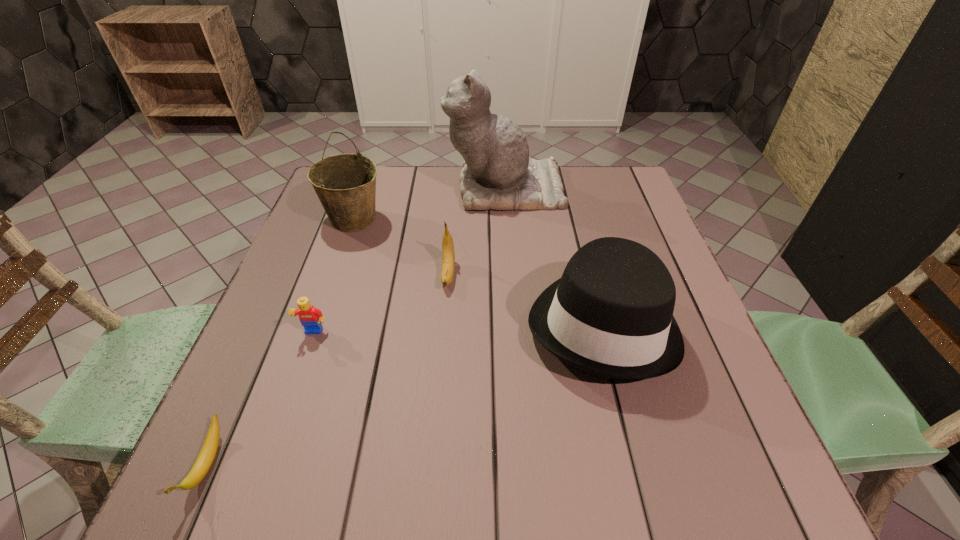
Where is `vacant space located 0.130m on the front-facing side of the tallest object`? Image resolution: width=960 pixels, height=540 pixels. vacant space located 0.130m on the front-facing side of the tallest object is located at coordinates (401, 188).

Image resolution: width=960 pixels, height=540 pixels. I want to click on blank space located on the right of the fifth shortest object, so click(x=453, y=219).

The image size is (960, 540). I want to click on vacant region located on the left of the third tallest object, so click(335, 323).

Where is `vacant region located 0.320m at the start of the peel on the right banana`? Image resolution: width=960 pixels, height=540 pixels. vacant region located 0.320m at the start of the peel on the right banana is located at coordinates (437, 428).

At what (x,y) coordinates should I click in order to perform the action: click on vacant space located on the face of the second shortest object. Please return your answer as a coordinate pair (x, y). The width and height of the screenshot is (960, 540). Looking at the image, I should click on (260, 491).

Where is `cat located in the far edge section of the desktop`? cat located in the far edge section of the desktop is located at coordinates (497, 173).

Locate an element on the screen. The height and width of the screenshot is (540, 960). wine bucket that is at the far edge is located at coordinates (345, 184).

Find the location of a particular element. The image size is (960, 540). object present at the near edge is located at coordinates (207, 454).

The width and height of the screenshot is (960, 540). In order to click on wine bucket positioned at the left edge in this screenshot , I will do `click(345, 184)`.

Image resolution: width=960 pixels, height=540 pixels. I want to click on Lego positioned at the left edge, so click(310, 317).